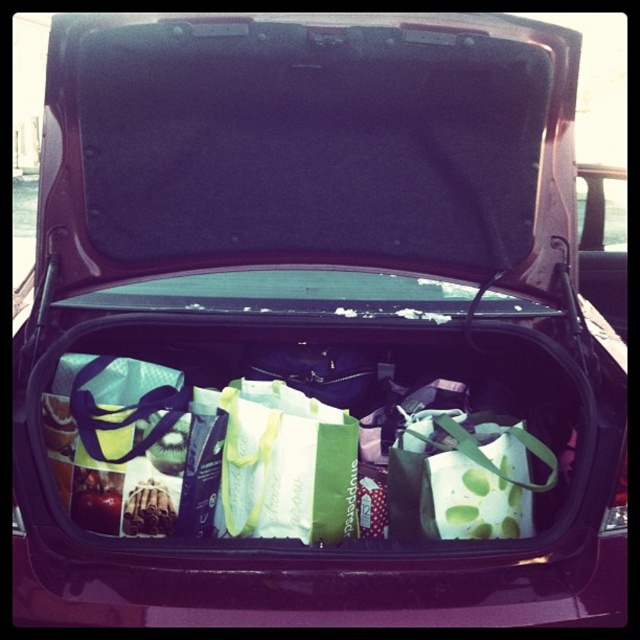
You are packing groceries into the car trunk and have two bags in front of you. You see the green paper gift bag at center and the green dotted paper bag at center. Which bag can you fit into a smaller space without needing to adjust its position?

The green paper gift bag at center is smaller than the green dotted paper bag at center, so it can fit into a smaller space without needing to adjust its position.

You are trying to place a 5 feet long item into the car trunk. The trunk has a green paper gift bag at center. Can you fit the item diagonally in the trunk?

The distance between the green paper gift bag at center and the other items is 4.94 feet. Since the item is 5 feet long, it might not fit diagonally as the available space is slightly shorter.

You are trying to find the green paper gift bag at center in the car trunk. According to the scene description, where exactly is it positioned?

The green paper gift bag at center is located at point (285, 465).